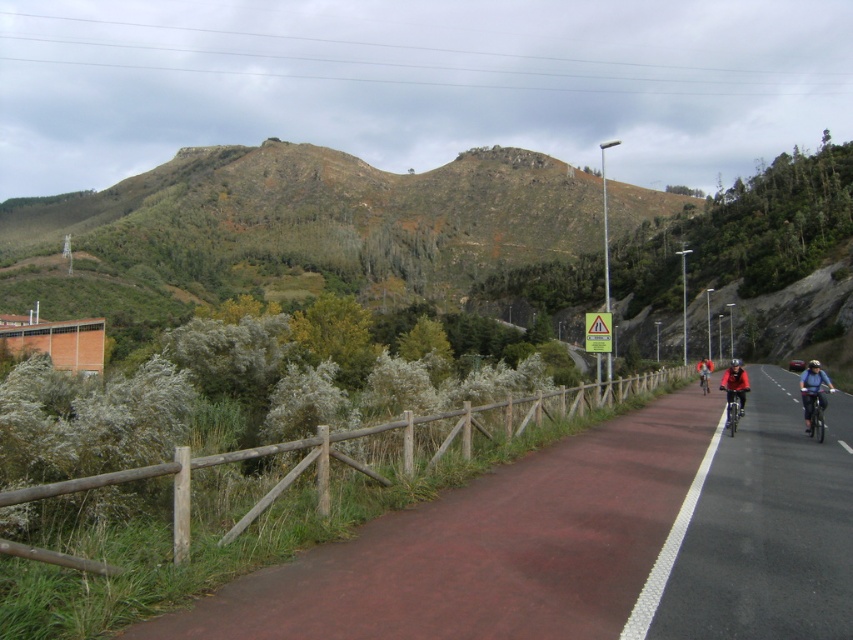
Based on the photo, measure the distance between red rubber bike path at center and camera.

16.77 feet

Is red rubber bike path at center closer to camera compared to shiny metallic bicycle at center-right?

Yes, it is in front of shiny metallic bicycle at center-right.

Is point (746, 490) farther from camera compared to point (738, 392)?

No, it is in front of (738, 392).

Find the location of a particular element. red rubber bike path at center is located at coordinates (759, 531).

Between point (726, 420) and point (709, 372), which one is positioned in front?

Point (726, 420) is in front.

Does shiny metallic bicycle at center-right have a greater height compared to matte black bicycle at center?

No.

Where is `shiny metallic bicycle at center-right`? This screenshot has width=853, height=640. shiny metallic bicycle at center-right is located at coordinates (x=734, y=408).

You are a GUI agent. You are given a task and a screenshot of the screen. Output one action in this format:
    pyautogui.click(x=<x>, y=<y>)
    Task: Click on the shiny metallic bicycle at center-right
    The height and width of the screenshot is (640, 853).
    Given the screenshot: What is the action you would take?
    pyautogui.click(x=734, y=408)

Does wooden at left appear over shiny metallic bicycle at center-right?

No, wooden at left is not above shiny metallic bicycle at center-right.

Can you confirm if wooden at left is wider than shiny metallic bicycle at center-right?

Yes.

What are the coordinates of `wooden at left` in the screenshot? It's located at pyautogui.click(x=218, y=464).